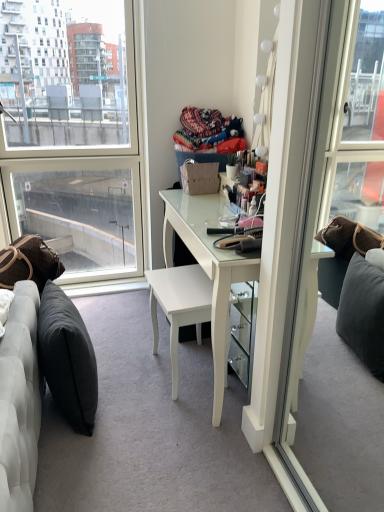
Question: Considering the positions of white glossy desk at center and dark gray fabric pillow at lower left, arranged as the 1th pillow when viewed from the right, in the image, is white glossy desk at center taller or shorter than dark gray fabric pillow at lower left, arranged as the 1th pillow when viewed from the right,?

Choices:
 (A) tall
 (B) short

Answer: (A)

Question: From the image's perspective, is white glossy desk at center above or below dark gray fabric pillow at lower left, arranged as the 1th pillow when viewed from the right?

Choices:
 (A) above
 (B) below

Answer: (A)

Question: Which of these objects is positioned farthest from the brown leather pillow at lower left, arranged as the second pillow when viewed from the right?

Choices:
 (A) white glossy desk at center
 (B) white glossy chair at center
 (C) transparent glass window at left
 (D) dark gray fabric pillow at lower left, arranged as the 1th pillow when viewed from the right

Answer: (C)

Question: Which object is positioned farthest from the dark gray fabric pillow at lower left, arranged as the 1th pillow when viewed from the right?

Choices:
 (A) white glossy chair at center
 (B) brown leather pillow at lower left, which is counted as the 1th pillow, starting from the left
 (C) white glossy desk at center
 (D) transparent glass window at left

Answer: (D)